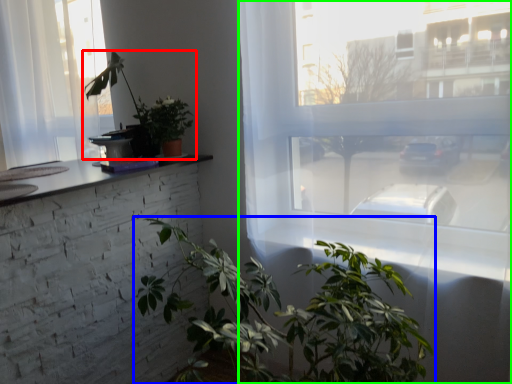
Question: Considering the real-world distances, which object is closest to houseplant (highlighted by a red box)? houseplant (highlighted by a blue box) or window (highlighted by a green box).

Choices:
 (A) houseplant
 (B) window

Answer: (B)